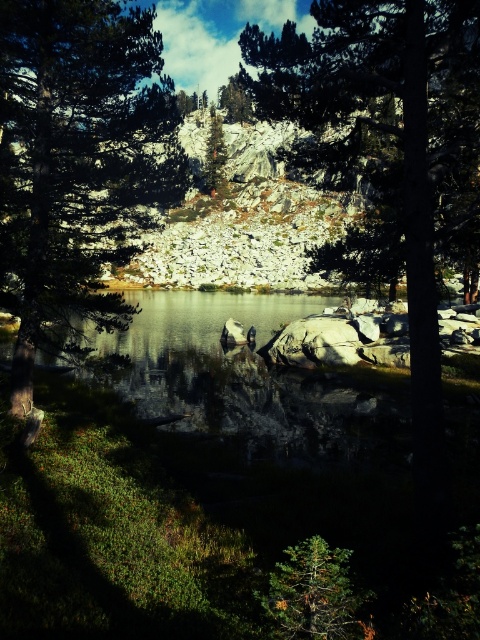
Looking at this image, you are standing at the edge of the lake in the serene landscape and notice two points marked in the image. The first point is at coordinates point (335,557), and the second is at point (226,188). If you want to walk towards the nearest point, which one should you head towards?

Point (335,557) is in front of point (226,188), so the nearest point to you is point (335,557). You should head towards point (335,557).